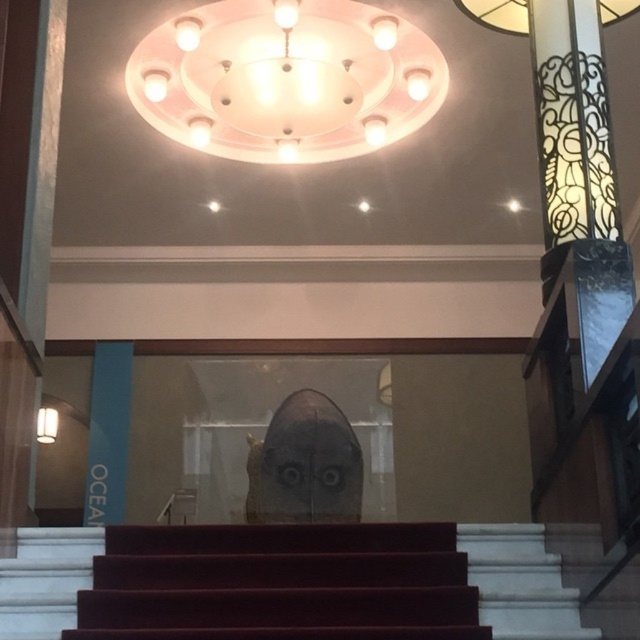
Question: Is matte white chandelier at upper center wider than matte white lampshade at left?

Choices:
 (A) no
 (B) yes

Answer: (B)

Question: Considering the real-world distances, which object is farthest from the matte white lampshade at left?

Choices:
 (A) maroon carpeted stairs at center
 (B) matte white chandelier at upper center

Answer: (A)

Question: Can you confirm if maroon carpeted stairs at center is wider than matte white lampshade at left?

Choices:
 (A) no
 (B) yes

Answer: (B)

Question: Does maroon carpeted stairs at center have a greater width compared to matte white lampshade at left?

Choices:
 (A) yes
 (B) no

Answer: (A)

Question: Which object is positioned closest to the matte white chandelier at upper center?

Choices:
 (A) maroon carpeted stairs at center
 (B) white marble stairs at center
 (C) matte white lampshade at left

Answer: (A)

Question: Which point is closer to the camera taking this photo?

Choices:
 (A) (51, 429)
 (B) (296, 596)

Answer: (B)